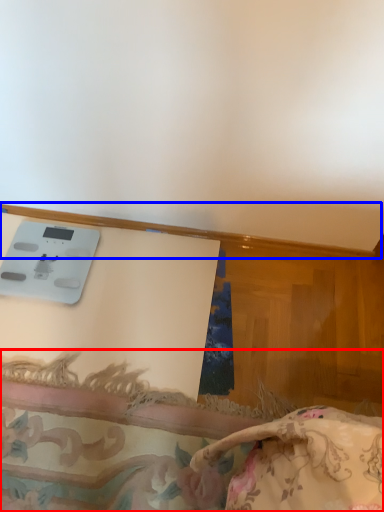
Question: Which object appears closest to the camera in this image, furniture (highlighted by a red box) or trim (highlighted by a blue box)?

Choices:
 (A) furniture
 (B) trim

Answer: (A)